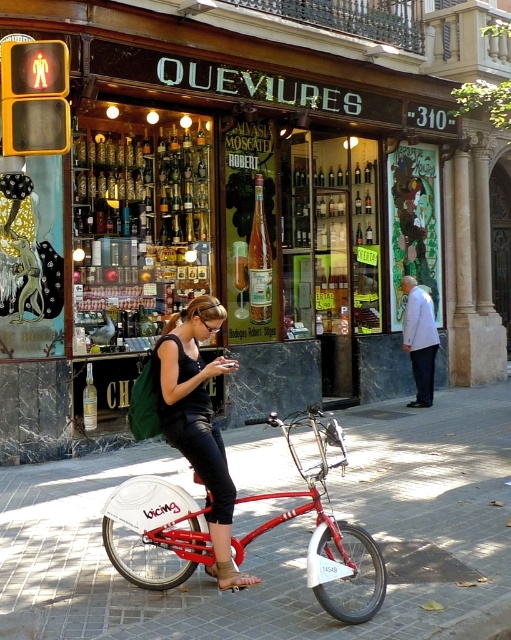
Question: Among these points, which one is farthest from the camera?

Choices:
 (A) (462, 554)
 (B) (138, 579)
 (C) (174, 412)

Answer: (A)

Question: Does brick pavement at center appear under matte black tank top at center?

Choices:
 (A) no
 (B) yes

Answer: (B)

Question: Which object appears closest to the camera in this image?

Choices:
 (A) matte black tank top at center
 (B) shiny red bicycle at center
 (C) brick pavement at center

Answer: (B)

Question: Can you confirm if brick pavement at center is bigger than shiny red bicycle at center?

Choices:
 (A) no
 (B) yes

Answer: (A)

Question: Which is nearer to the shiny red bicycle at center?

Choices:
 (A) matte black tank top at center
 (B) brick pavement at center

Answer: (A)

Question: Can you confirm if shiny red bicycle at center is positioned to the left of matte black tank top at center?

Choices:
 (A) no
 (B) yes

Answer: (B)